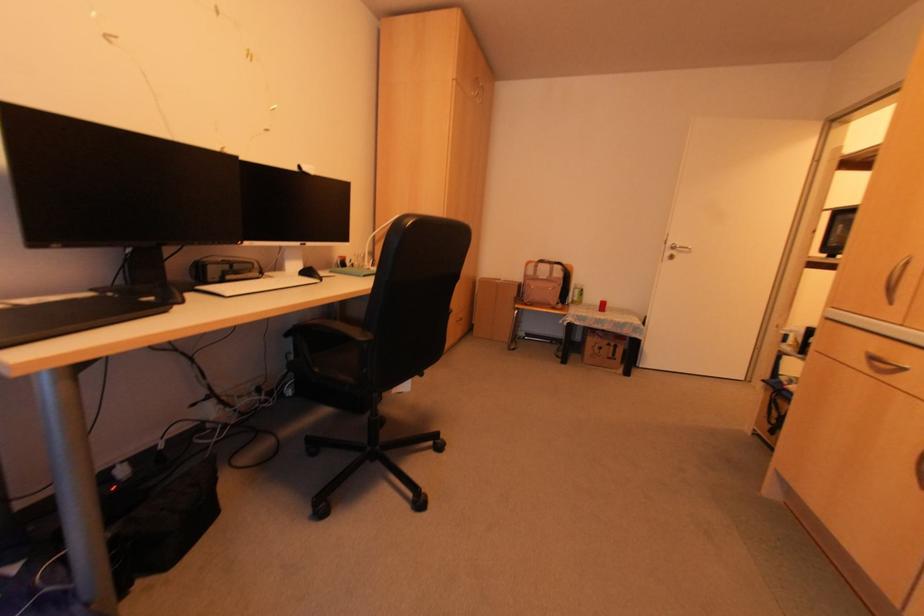
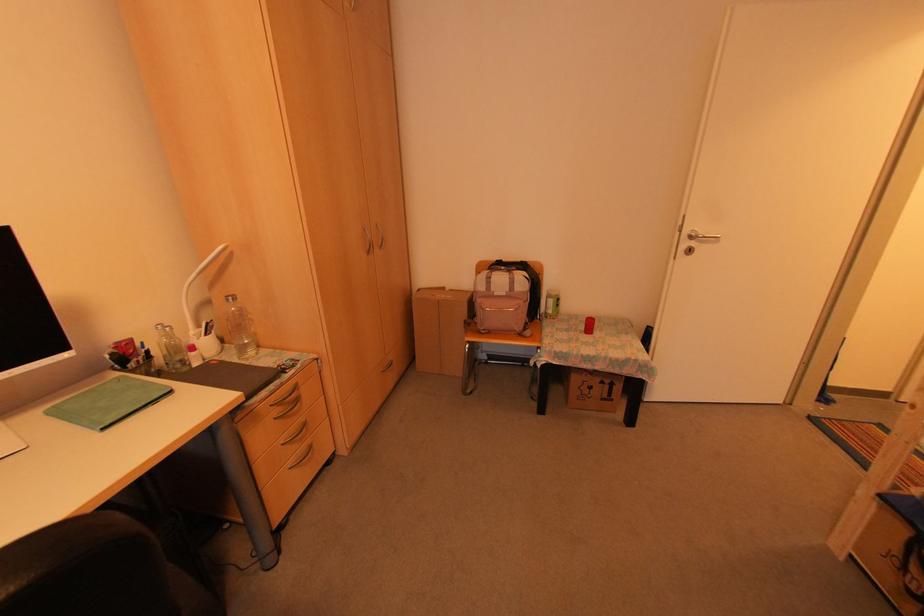
Where in the second image is the point corresponding to point 458,317 from the first image?

(388, 359)